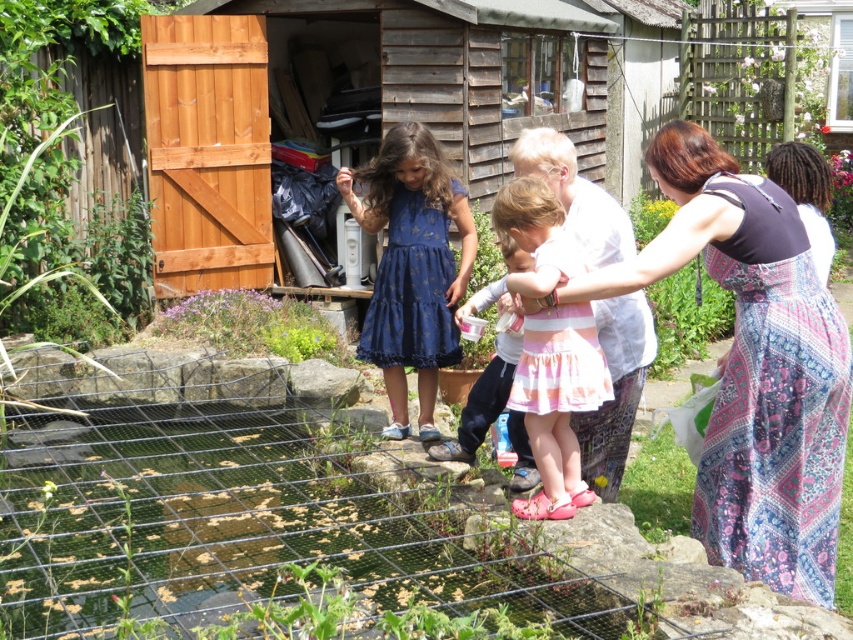
Question: Does wooden shed at upper center have a lesser width compared to blue satin dress at center?

Choices:
 (A) yes
 (B) no

Answer: (A)

Question: Which object is closer to the camera taking this photo?

Choices:
 (A) wooden shed at upper center
 (B) printed cotton dress at center
 (C) blue satin dress at center
 (D) pink striped skirt at center

Answer: (B)

Question: Does pink striped skirt at center have a larger size compared to pink satin dress at center?

Choices:
 (A) no
 (B) yes

Answer: (A)

Question: Which of the following is the farthest from the observer?

Choices:
 (A) 796,248
 (B) 589,396
 (C) 491,70
 (D) 416,132

Answer: (C)

Question: Does blue satin dress at center have a lesser width compared to pink satin dress at center?

Choices:
 (A) yes
 (B) no

Answer: (B)

Question: Which is farther from the printed cotton dress at center?

Choices:
 (A) pink satin dress at center
 (B) wooden shed at upper center
 (C) blue satin dress at center
 (D) pink striped skirt at center

Answer: (B)